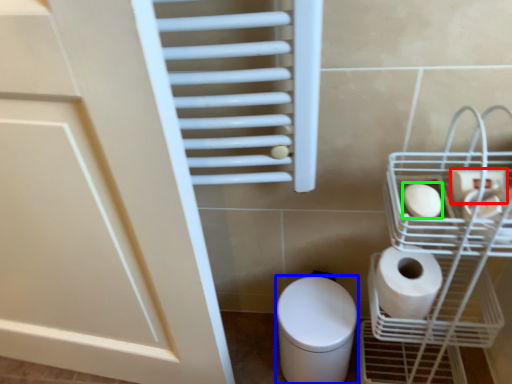
Question: Which object is the closest to the toilet paper (highlighted by a red box)? Choose among these: bidet (highlighted by a blue box) or toilet paper (highlighted by a green box).

Choices:
 (A) bidet
 (B) toilet paper

Answer: (B)